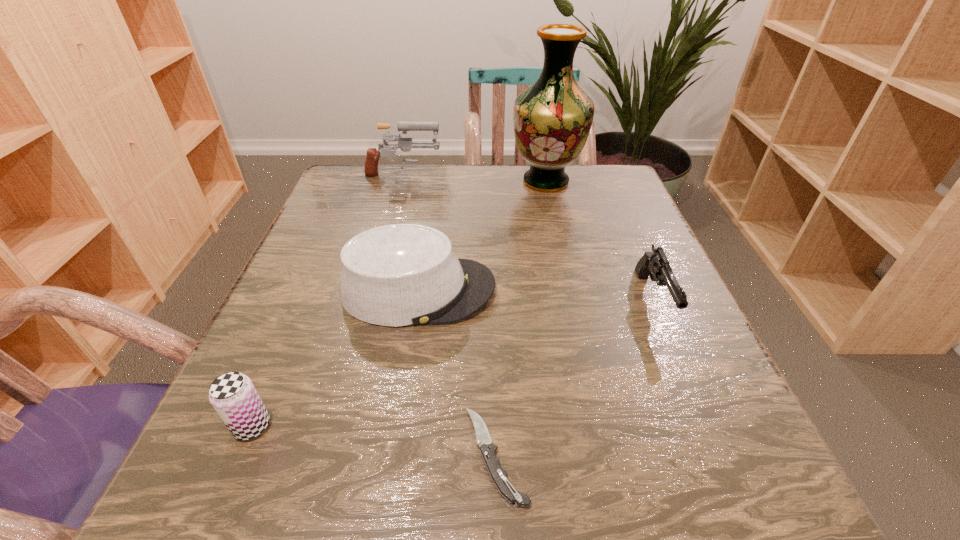
The image size is (960, 540). Find the location of `vacant space situated 0.380m at the barrel end of the left gun`. vacant space situated 0.380m at the barrel end of the left gun is located at coordinates (592, 178).

Find the location of `vacant space located on the front-facing side of the hat`. vacant space located on the front-facing side of the hat is located at coordinates (635, 290).

The width and height of the screenshot is (960, 540). What are the coordinates of `free location located 0.190m at the end of the barrel of the rightmost object` in the screenshot? It's located at (717, 452).

The image size is (960, 540). I want to click on vacant space located 0.160m on the back of the beer can, so click(295, 325).

The width and height of the screenshot is (960, 540). I want to click on free spot located 0.160m on the back of the pocketknife, so click(x=492, y=325).

At what (x,y) coordinates should I click in order to perform the action: click on vase that is at the far edge. Please return your answer as a coordinate pair (x, y). Looking at the image, I should click on (552, 118).

What are the coordinates of `gun that is positioned at the far edge` in the screenshot? It's located at (405, 144).

This screenshot has height=540, width=960. I want to click on object that is at the near edge, so click(x=498, y=475).

Locate an element on the screen. gun located in the left edge section of the desktop is located at coordinates (405, 144).

The height and width of the screenshot is (540, 960). Find the location of `hat that is at the left edge`. hat that is at the left edge is located at coordinates (396, 275).